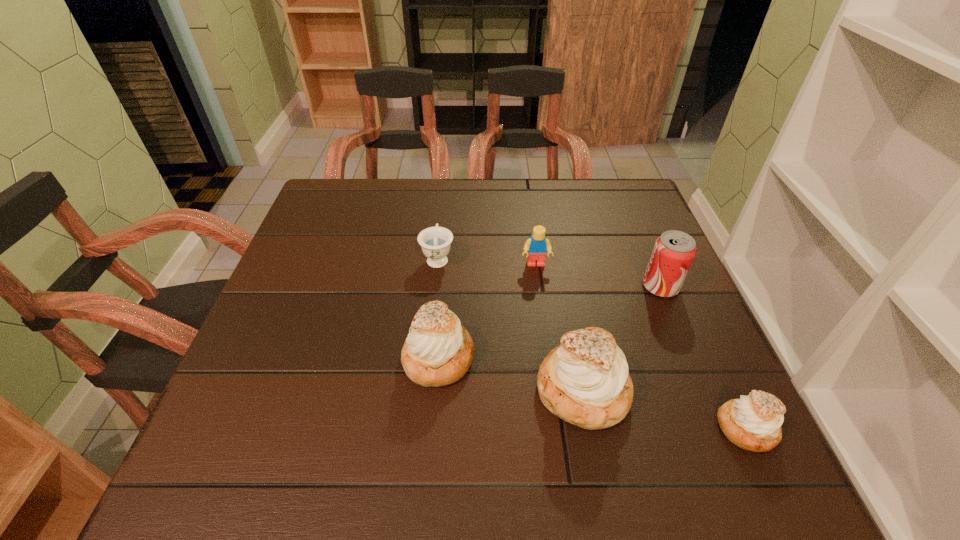
Find the location of a particular element. vacant point that satisfies the following two spatial constraints: 1. on the front side of the second shortest pastry; 2. on the left side of the second pastry from left to right is located at coordinates (436, 390).